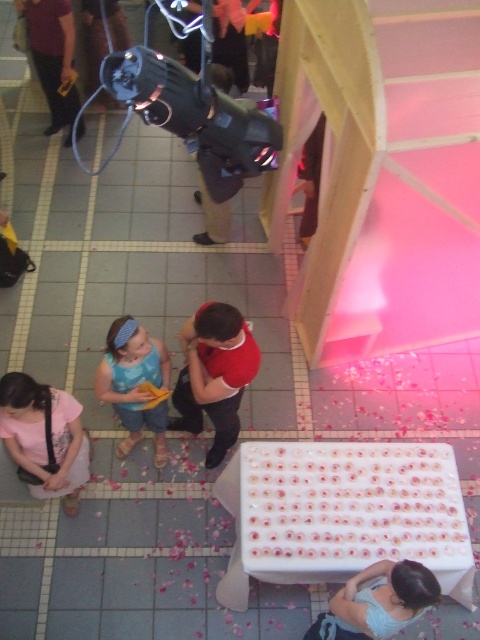
Question: Does matte pink shirt at lower left appear over blue denim shorts at lower left?

Choices:
 (A) yes
 (B) no

Answer: (B)

Question: Which point is closer to the camera taking this photo?

Choices:
 (A) (76, 436)
 (B) (135, 403)

Answer: (A)

Question: Can you confirm if matte pink shirt at lower left is positioned above blue denim shorts at lower left?

Choices:
 (A) yes
 (B) no

Answer: (B)

Question: Is matte pink shirt at lower left positioned before blue denim shorts at lower left?

Choices:
 (A) yes
 (B) no

Answer: (A)